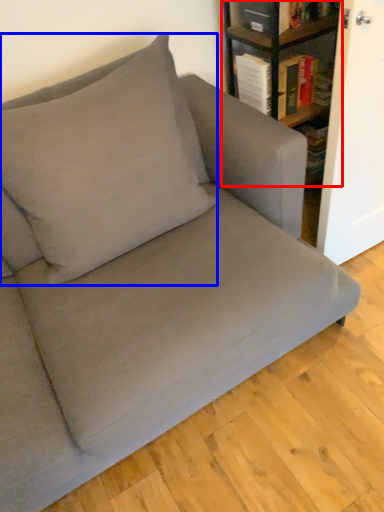
Question: Which of the following is the farthest to the observer, shelf (highlighted by a red box) or throw pillow (highlighted by a blue box)?

Choices:
 (A) shelf
 (B) throw pillow

Answer: (A)